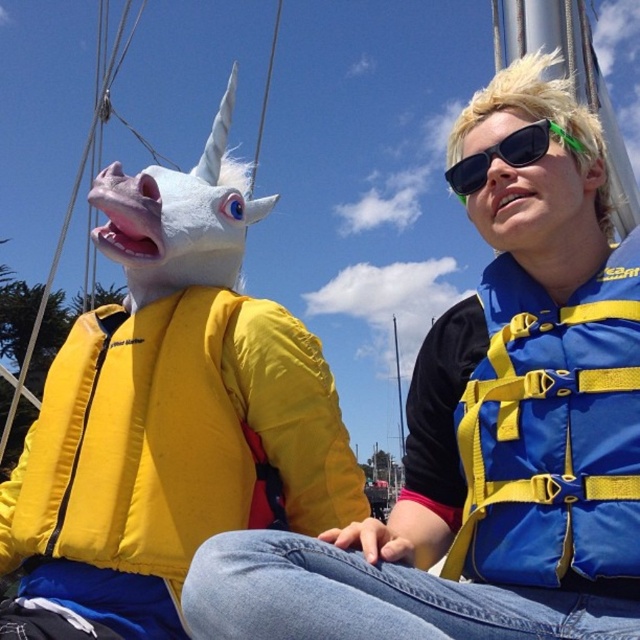
Question: Based on their relative distances, which object is nearer to the sunglasses at upper right?

Choices:
 (A) blue fabric life jacket at right
 (B) yellow foam life jacket at left

Answer: (A)

Question: Considering the real-world distances, which object is closest to the blue fabric life jacket at right?

Choices:
 (A) sunglasses at upper right
 (B) yellow foam life jacket at left

Answer: (A)

Question: Among these points, which one is farthest from the camera?

Choices:
 (A) (474, 163)
 (B) (481, 477)
 (C) (188, 547)

Answer: (A)

Question: Is yellow foam life jacket at left thinner than blue fabric life jacket at right?

Choices:
 (A) yes
 (B) no

Answer: (B)

Question: Is blue fabric life jacket at right to the right of sunglasses at upper right from the viewer's perspective?

Choices:
 (A) yes
 (B) no

Answer: (A)

Question: Is yellow foam life jacket at left smaller than blue fabric life jacket at right?

Choices:
 (A) no
 (B) yes

Answer: (A)